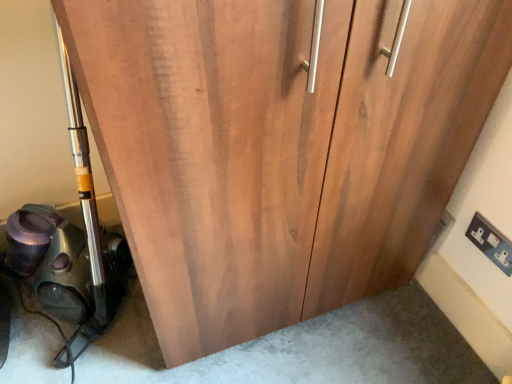
Question: Is white plastic electric outlet at lower right to the right of metallic vacuum cleaner at left from the viewer's perspective?

Choices:
 (A) no
 (B) yes

Answer: (B)

Question: Is white plastic electric outlet at lower right shorter than metallic vacuum cleaner at left?

Choices:
 (A) yes
 (B) no

Answer: (A)

Question: From a real-world perspective, is white plastic electric outlet at lower right located higher than metallic vacuum cleaner at left?

Choices:
 (A) no
 (B) yes

Answer: (A)

Question: Does white plastic electric outlet at lower right come behind metallic vacuum cleaner at left?

Choices:
 (A) no
 (B) yes

Answer: (B)

Question: Is white plastic electric outlet at lower right with metallic vacuum cleaner at left?

Choices:
 (A) yes
 (B) no

Answer: (B)

Question: Could metallic vacuum cleaner at left be considered to be inside white plastic electric outlet at lower right?

Choices:
 (A) no
 (B) yes

Answer: (A)

Question: Is metallic vacuum cleaner at left further to the viewer compared to white plastic electric outlet at lower right?

Choices:
 (A) no
 (B) yes

Answer: (A)

Question: From a real-world perspective, is metallic vacuum cleaner at left beneath white plastic electric outlet at lower right?

Choices:
 (A) yes
 (B) no

Answer: (B)

Question: Is metallic vacuum cleaner at left in contact with white plastic electric outlet at lower right?

Choices:
 (A) yes
 (B) no

Answer: (B)

Question: Considering the relative sizes of metallic vacuum cleaner at left and white plastic electric outlet at lower right in the image provided, is metallic vacuum cleaner at left wider than white plastic electric outlet at lower right?

Choices:
 (A) yes
 (B) no

Answer: (A)

Question: From the image's perspective, is metallic vacuum cleaner at left beneath white plastic electric outlet at lower right?

Choices:
 (A) no
 (B) yes

Answer: (A)

Question: Is the depth of metallic vacuum cleaner at left less than that of white plastic electric outlet at lower right?

Choices:
 (A) no
 (B) yes

Answer: (B)

Question: Is white plastic electric outlet at lower right taller or shorter than metallic vacuum cleaner at left?

Choices:
 (A) short
 (B) tall

Answer: (A)